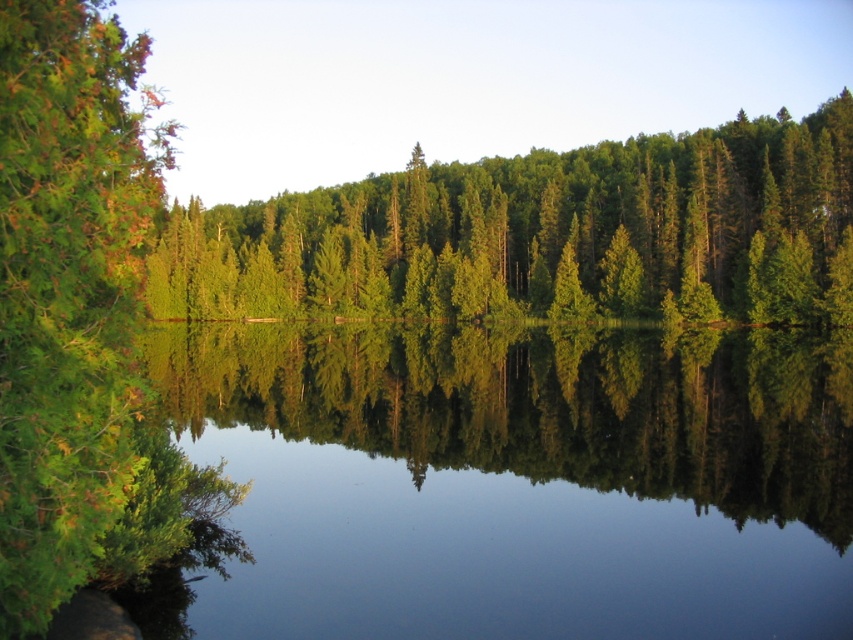
Question: Which point is farther from the camera taking this photo?

Choices:
 (A) (74, 396)
 (B) (407, 497)
 (C) (640, 225)

Answer: (C)

Question: Which object is positioned farthest from the clear water at center?

Choices:
 (A) green leafy tree at left
 (B) green matte tree at center

Answer: (A)

Question: In this image, where is clear water at center located relative to green leafy tree at left?

Choices:
 (A) above
 (B) below

Answer: (B)

Question: Which of the following is the closest to the observer?

Choices:
 (A) (71, 388)
 (B) (685, 208)
 (C) (607, 458)

Answer: (A)

Question: Where is clear water at center located in relation to green leafy tree at left in the image?

Choices:
 (A) above
 (B) below

Answer: (B)

Question: Does clear water at center come in front of green leafy tree at left?

Choices:
 (A) yes
 (B) no

Answer: (B)